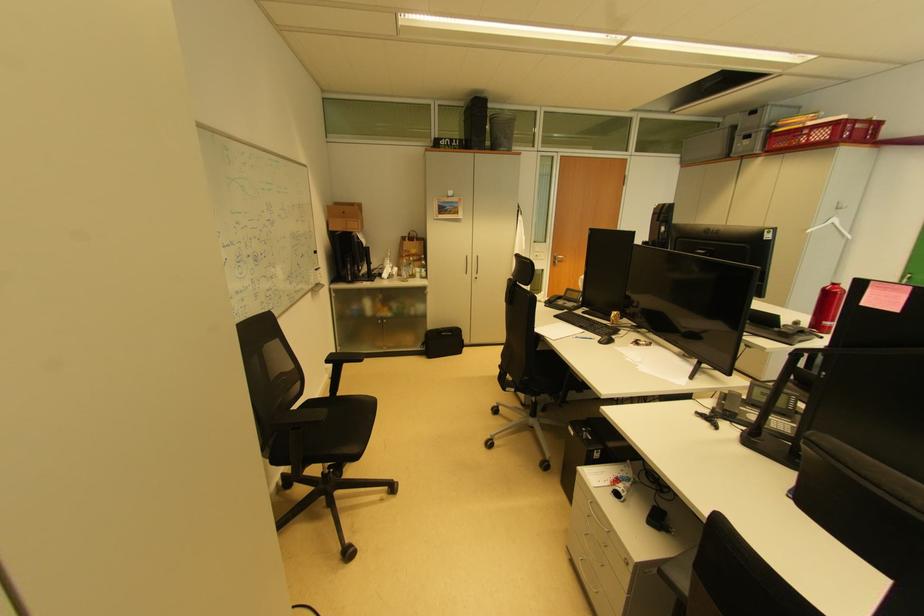
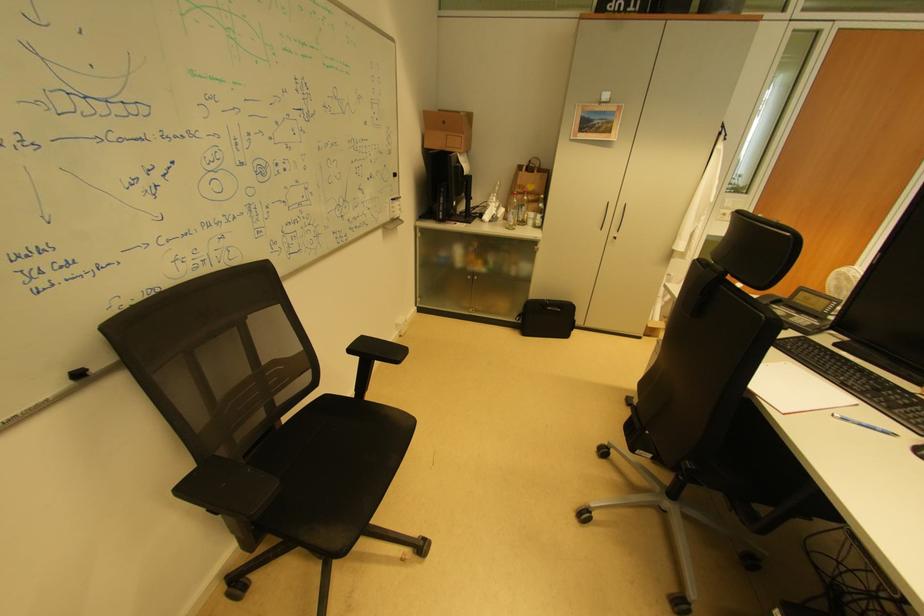
Where in the second image is the point corresponding to [415,268] from the first image?

(523, 209)